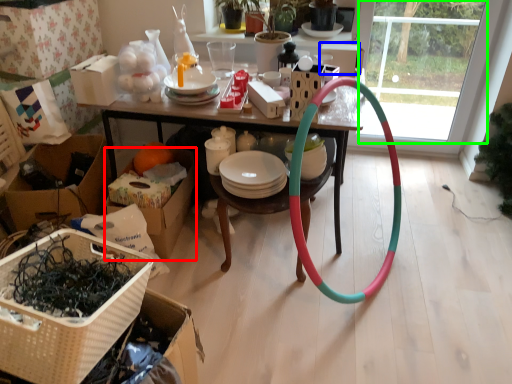
Question: Estimate the real-world distances between objects in this image. Which object is closer to cardboard box (highlighted by a red box), box (highlighted by a blue box) or glass door (highlighted by a green box)?

Choices:
 (A) box
 (B) glass door

Answer: (A)